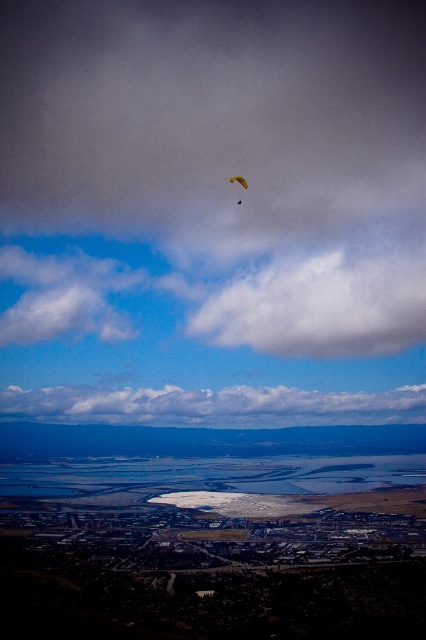
You are a drone operator trying to navigate between two points in the landscape. The first point is at coordinates point (236, 282) and the second is at point (39, 404). According to the image, which point is closer to your current position?

Point (236, 282) is closer to the camera than point (39, 404), so the first point is closer to your current position.

You are an observer looking at the sky in the image. You see a white fluffy cloud at upper center and a yellow fabric parasail at upper center. Which object is larger in size?

The white fluffy cloud at upper center is bigger than the yellow fabric parasail at upper center.

You are an airplane pilot flying over the landscape. You notice two white fluffy clouds in the sky. Which one is higher in the sky between the white fluffy cloud at upper center and the white fluffy cloud at center?

The white fluffy cloud at upper center is higher in the sky compared to the white fluffy cloud at center.